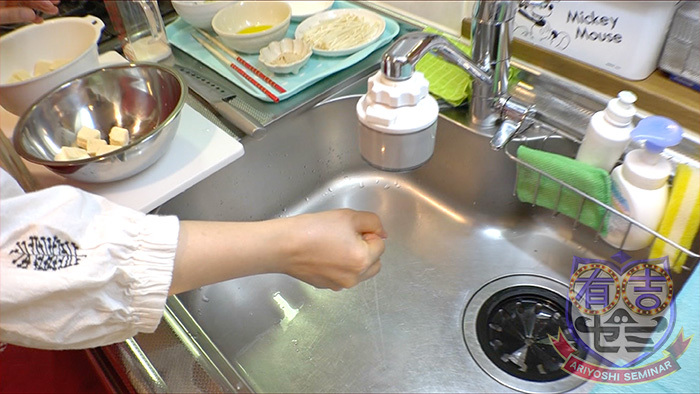
Where is `water purifier`? water purifier is located at coordinates pos(395,128).